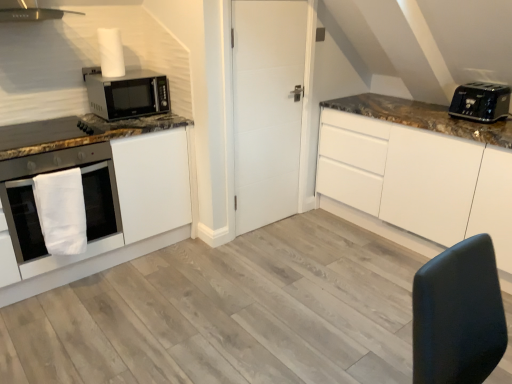
Question: From a real-world perspective, is matte black microwave at upper left positioned over black plastic toaster at upper right based on gravity?

Choices:
 (A) no
 (B) yes

Answer: (B)

Question: Is matte black microwave at upper left at the right side of black plastic toaster at upper right?

Choices:
 (A) yes
 (B) no

Answer: (B)

Question: Is black plastic toaster at upper right completely or partially inside matte black microwave at upper left?

Choices:
 (A) yes
 (B) no

Answer: (B)

Question: Is matte black microwave at upper left taller than black plastic toaster at upper right?

Choices:
 (A) yes
 (B) no

Answer: (A)

Question: From the image's perspective, is matte black microwave at upper left located above black plastic toaster at upper right?

Choices:
 (A) no
 (B) yes

Answer: (B)

Question: Is white matte cabinet at upper right, which ranks as the first cabinetry in right-to-left order, bigger or smaller than white matte door at center?

Choices:
 (A) small
 (B) big

Answer: (B)

Question: Would you say white matte cabinet at upper right, which ranks as the first cabinetry in right-to-left order, is to the left or to the right of white matte door at center in the picture?

Choices:
 (A) right
 (B) left

Answer: (A)

Question: In terms of width, does white matte cabinet at upper right, which ranks as the first cabinetry in right-to-left order, look wider or thinner when compared to white matte door at center?

Choices:
 (A) wide
 (B) thin

Answer: (A)

Question: From a real-world perspective, relative to white matte door at center, is white matte cabinet at upper right, which ranks as the first cabinetry in right-to-left order, vertically above or below?

Choices:
 (A) below
 (B) above

Answer: (A)

Question: Is point coord(144,87) closer or farther from the camera than point coord(295,167)?

Choices:
 (A) farther
 (B) closer

Answer: (B)

Question: In the image, is matte black microwave at upper left positioned in front of or behind white matte door at center?

Choices:
 (A) front
 (B) behind

Answer: (B)

Question: Is matte black microwave at upper left bigger or smaller than white matte door at center?

Choices:
 (A) big
 (B) small

Answer: (B)

Question: Is matte black microwave at upper left spatially inside white matte door at center, or outside of it?

Choices:
 (A) outside
 (B) inside

Answer: (A)

Question: Considering the relative positions of satin white cabinet at left, which is the second cabinetry from right to left, and white matte door at center in the image provided, is satin white cabinet at left, which is the second cabinetry from right to left, to the left or to the right of white matte door at center?

Choices:
 (A) left
 (B) right

Answer: (A)

Question: From their relative heights in the image, would you say satin white cabinet at left, which is the second cabinetry from right to left, is taller or shorter than white matte door at center?

Choices:
 (A) short
 (B) tall

Answer: (A)